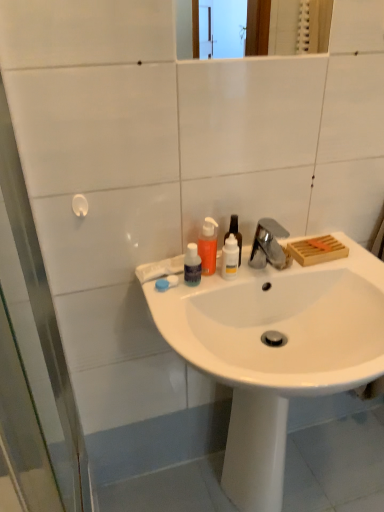
Question: Considering their positions, is satin nickel faucet at upper center located in front of or behind translucent plastic bottle at center, which is the 2th bottle from right to left?

Choices:
 (A) front
 (B) behind

Answer: (B)

Question: From a real-world perspective, is satin nickel faucet at upper center physically located above or below translucent plastic bottle at center, which is the 2th bottle from right to left?

Choices:
 (A) below
 (B) above

Answer: (A)

Question: Which is nearer to the satin nickel faucet at upper center?

Choices:
 (A) white glossy sink at center
 (B) white plastic hook at left
 (C) translucent orange liquid at sink center, acting as the third bottle starting from the right
 (D) transparent plastic bottle at center, placed as the 1th bottle when sorted from right to left
 (E) transparent plastic bottle at center, arranged as the 1th bottle when viewed from the left

Answer: (D)

Question: Estimate the real-world distances between objects in this image. Which object is farther from the white glossy sink at center?

Choices:
 (A) transparent plastic bottle at center, arranged as the 1th bottle when viewed from the left
 (B) white plastic hook at left
 (C) transparent plastic bottle at center, placed as the 1th bottle when sorted from right to left
 (D) satin nickel faucet at upper center
 (E) translucent plastic bottle at center, which is the 2th bottle from right to left

Answer: (B)